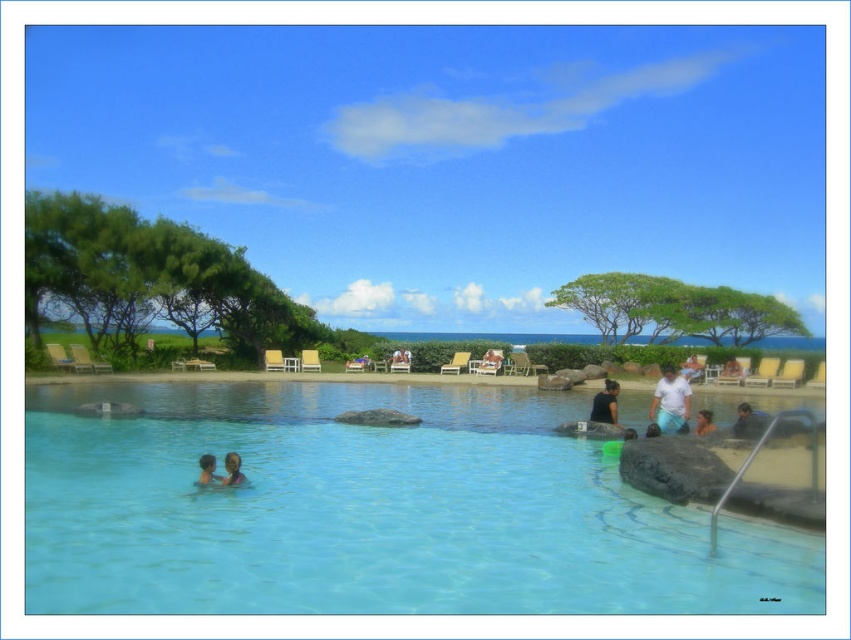
Question: Among these points, which one is nearest to the camera?

Choices:
 (A) (684, 392)
 (B) (236, 474)

Answer: (B)

Question: Does black matte shirt at center have a lesser width compared to smooth skin face at lower right?

Choices:
 (A) no
 (B) yes

Answer: (A)

Question: Which is farther from the white cotton shirt at upper right?

Choices:
 (A) smooth skin person at lower left
 (B) black matte shirt at center
 (C) clear blue water at center
 (D) smooth skin face at lower right

Answer: (A)

Question: Which object is closer to the camera taking this photo?

Choices:
 (A) black matte shirt at center
 (B) smooth skin person at lower left
 (C) smooth skin face at lower right

Answer: (B)

Question: Does smooth skin person at lower left lie behind smooth skin face at lower right?

Choices:
 (A) yes
 (B) no

Answer: (B)

Question: Does smooth skin person at lower left appear on the right side of smooth skin face at lower right?

Choices:
 (A) no
 (B) yes

Answer: (A)